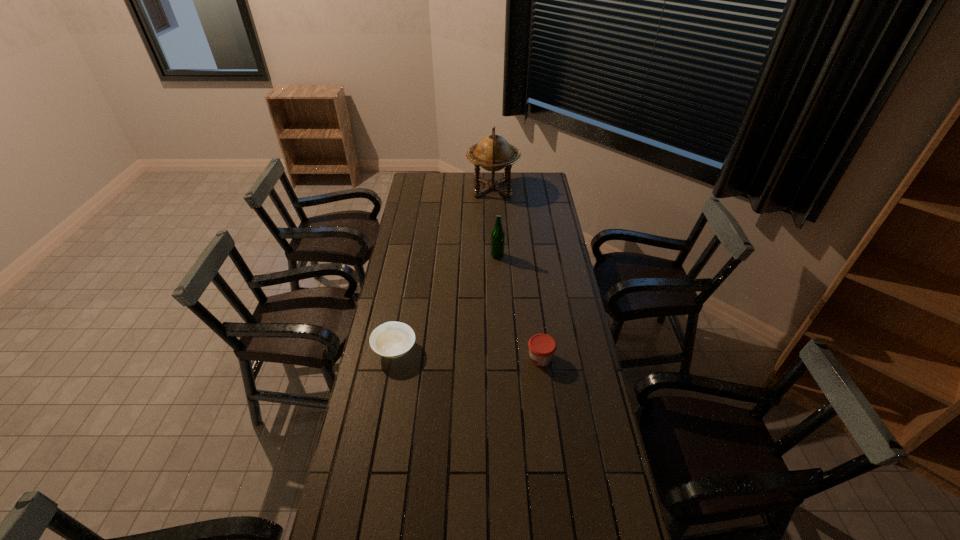
Find the location of `the farthest object`. the farthest object is located at coordinates (493, 153).

Identify the location of the tallest object. The image size is (960, 540). (493, 153).

Image resolution: width=960 pixels, height=540 pixels. Find the location of `the second farthest object`. the second farthest object is located at coordinates (498, 235).

What are the coordinates of `beer bottle` in the screenshot? It's located at (498, 235).

Identify the location of jam. (541, 346).

At what (x,y) coordinates should I click in order to perform the action: click on the leftmost object. Please return your answer as a coordinate pair (x, y). Looking at the image, I should click on (392, 339).

You are a GUI agent. You are given a task and a screenshot of the screen. Output one action in this format:
    pyautogui.click(x=<x>, y=<y>)
    Task: Click on the shortest object
    
    Given the screenshot: What is the action you would take?
    [392, 339]

The height and width of the screenshot is (540, 960). I want to click on vacant point located 0.210m on the front-facing side of the tallest object, so click(x=431, y=188).

Image resolution: width=960 pixels, height=540 pixels. I want to click on free spot located 0.080m on the front-facing side of the tallest object, so 453,188.

This screenshot has height=540, width=960. Identify the location of free space located 0.310m on the front-facing side of the tallest object. (414, 188).